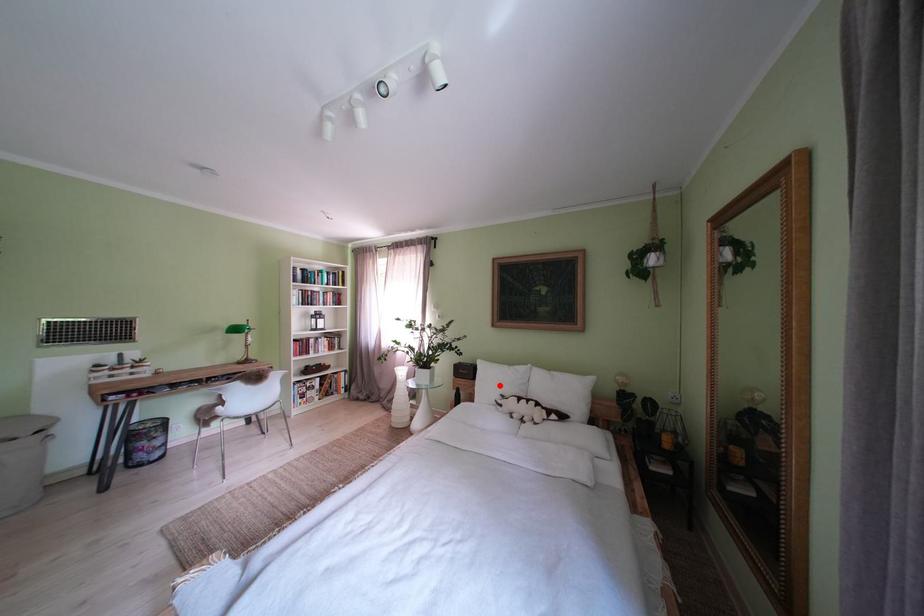
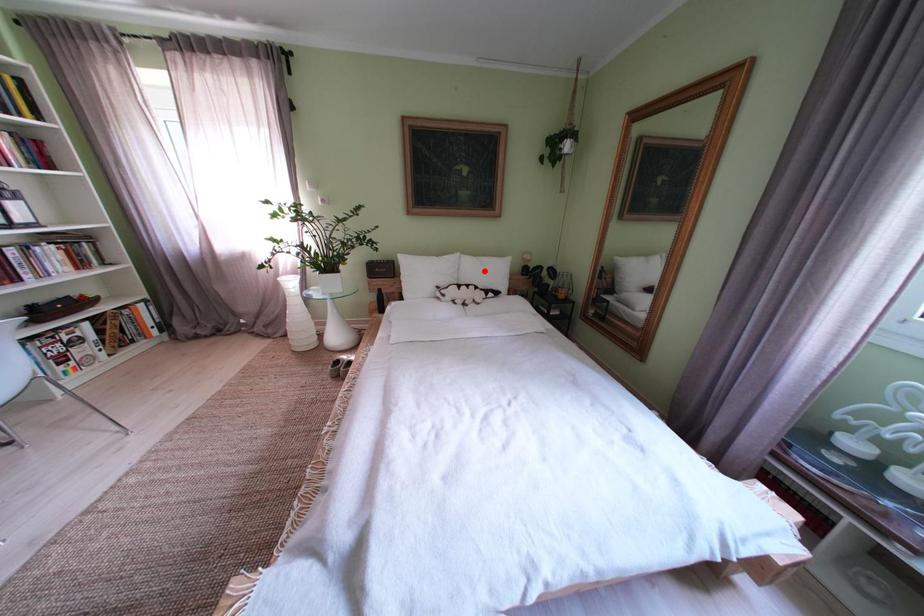
I am providing you with two images of the same scene from different viewpoints. A red point is marked on the first image and another point is marked on the second image. Does the point marked in image1 correspond to the same location as the one in image2?

No